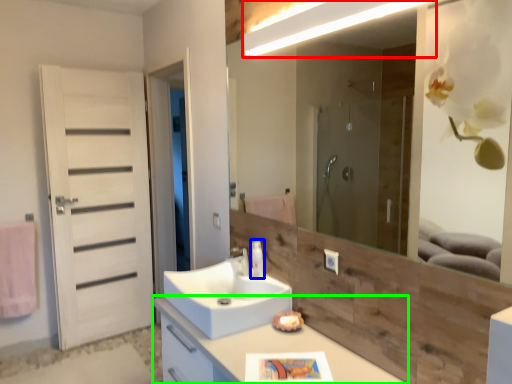
Question: Which is nearer to the light fixture (highlighted by a red box)? soap dispenser (highlighted by a blue box) or bathroom cabinet (highlighted by a green box).

Choices:
 (A) soap dispenser
 (B) bathroom cabinet

Answer: (A)